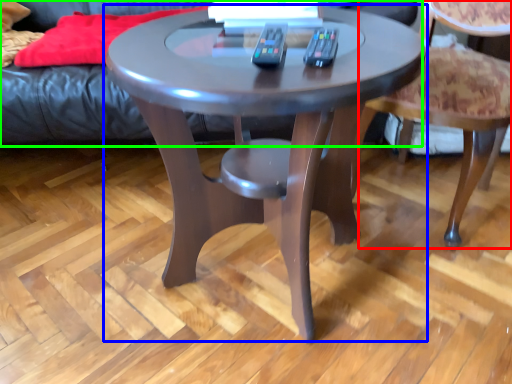
Question: Estimate the real-world distances between objects in this image. Which object is closer to chair (highlighted by a red box), coffee table (highlighted by a blue box) or couch (highlighted by a green box)?

Choices:
 (A) coffee table
 (B) couch

Answer: (A)